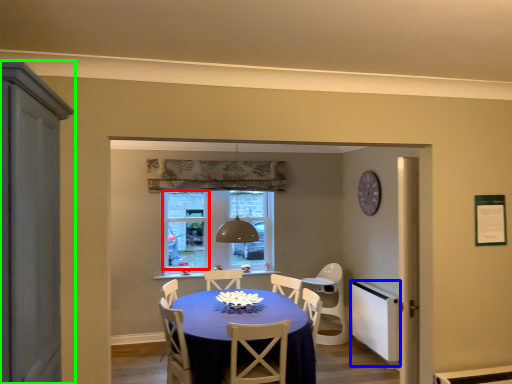
Question: Considering the real-world distances, which object is closest to window screen (highlighted by a red box)? appliance (highlighted by a blue box) or cabinetry (highlighted by a green box).

Choices:
 (A) appliance
 (B) cabinetry

Answer: (A)